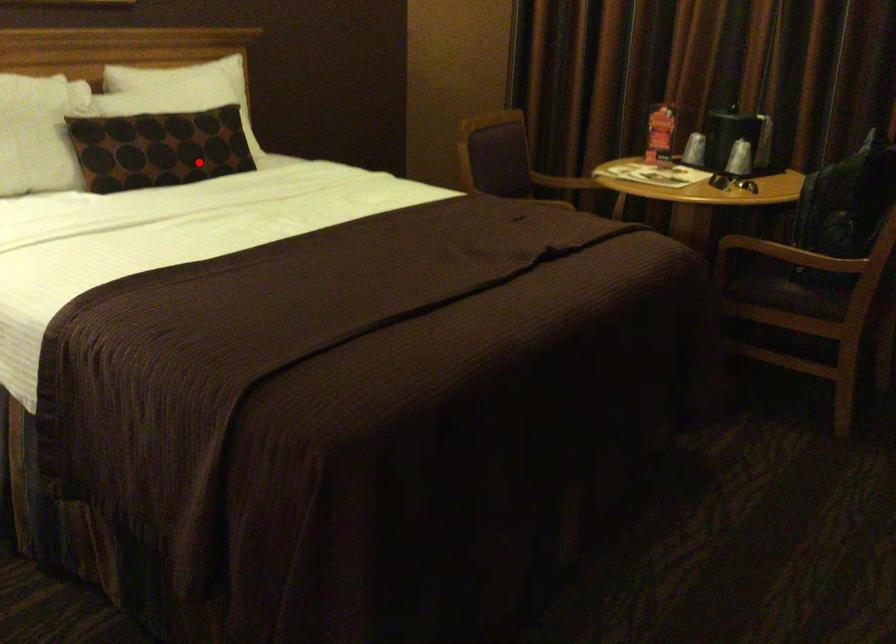
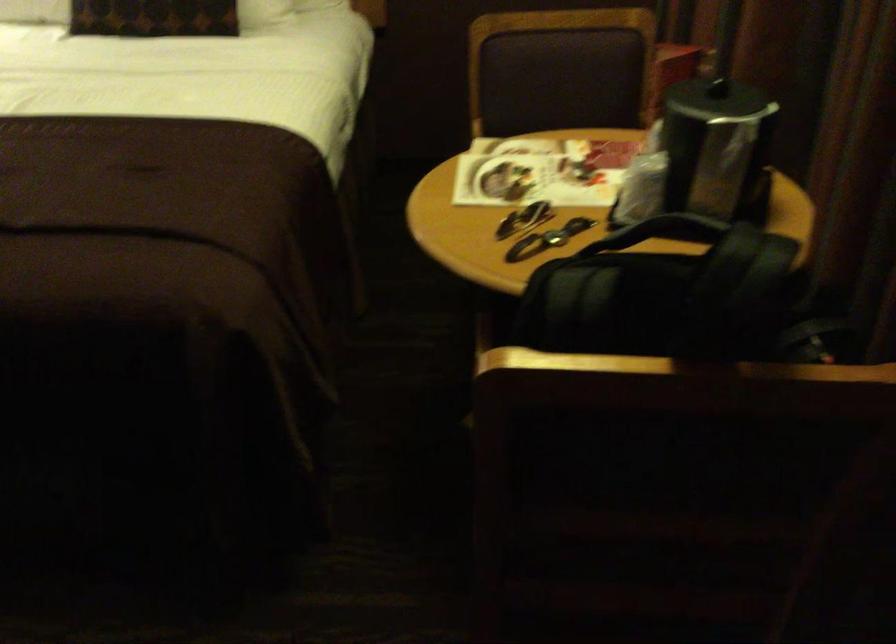
Locate, in the second image, the point that corresponds to the highlighted location in the first image.

(152, 17)